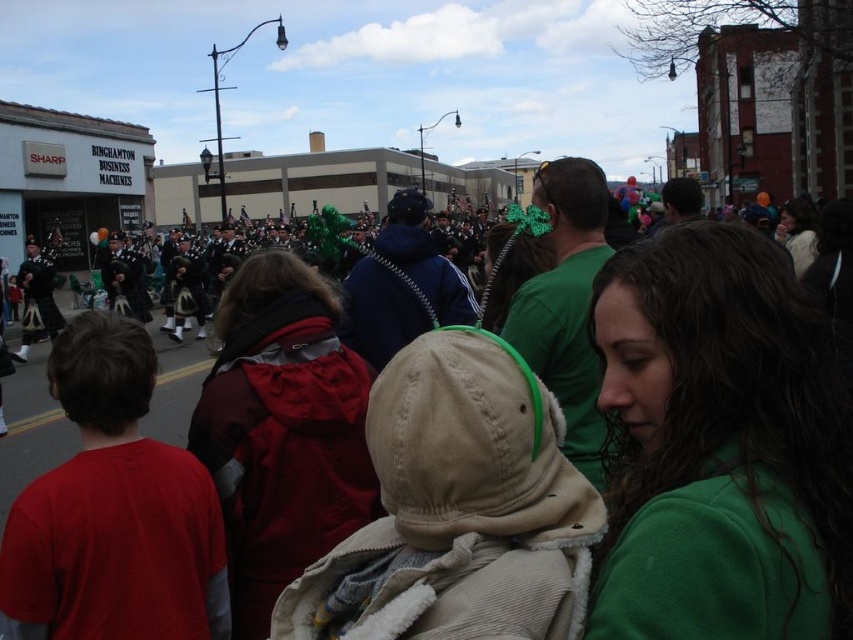
Question: Where is green fleece jacket at center located in relation to matte green hat at center in the image?

Choices:
 (A) above
 (B) below

Answer: (B)

Question: Is red cotton shirt at center wider than matte green hat at center?

Choices:
 (A) no
 (B) yes

Answer: (A)

Question: Can you confirm if red cotton shirt at center is positioned to the left of matte green hat at center?

Choices:
 (A) yes
 (B) no

Answer: (A)

Question: Which object is closer to the camera taking this photo?

Choices:
 (A) red cotton shirt at center
 (B) matte green hat at center
 (C) green fleece jacket at center

Answer: (C)

Question: Which of these objects is positioned farthest from the matte green hat at center?

Choices:
 (A) red cotton shirt at center
 (B) green fleece jacket at center

Answer: (A)

Question: Among these objects, which one is nearest to the camera?

Choices:
 (A) green fleece jacket at center
 (B) red cotton shirt at center

Answer: (A)